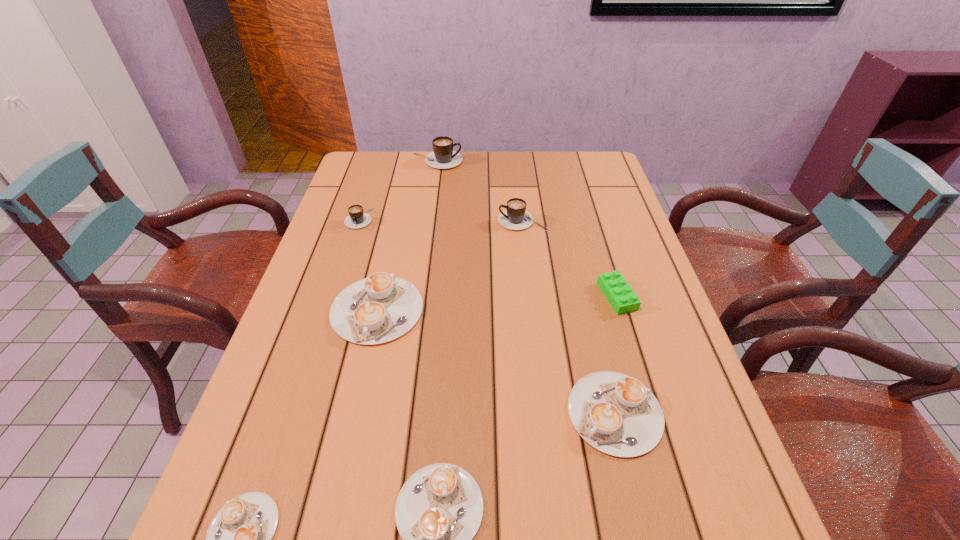
Find the location of a particular element. Image resolution: width=960 pixels, height=540 pixels. cappuccino that is at the right edge is located at coordinates (616, 414).

This screenshot has width=960, height=540. In the image, there is a desktop. In order to click on vacant area at the far edge in this screenshot , I will do `click(510, 153)`.

You are a GUI agent. You are given a task and a screenshot of the screen. Output one action in this format:
    pyautogui.click(x=<x>, y=<y>)
    Task: Click on the blank space at the left edge of the desktop
    This screenshot has width=960, height=540.
    Given the screenshot: What is the action you would take?
    pyautogui.click(x=377, y=226)

In the image, there is a desktop. Identify the location of free space at the right edge. (634, 231).

In the image, there is a desktop. Identify the location of vacant space at the far right corner. The height and width of the screenshot is (540, 960). (578, 166).

The image size is (960, 540). I want to click on vacant space that's between the Lego and the fourth nearest cappuccino, so click(497, 303).

The image size is (960, 540). What are the coordinates of `vacant area between the second tallest cappuccino and the fourth nearest cappuccino` in the screenshot? It's located at (449, 265).

Image resolution: width=960 pixels, height=540 pixels. In order to click on free space between the rightmost black cappuccino and the smallest black cappuccino in this screenshot , I will do `click(441, 220)`.

Where is `free space that is in between the biggest black cappuccino and the Lego`? Image resolution: width=960 pixels, height=540 pixels. free space that is in between the biggest black cappuccino and the Lego is located at coordinates (527, 228).

Identify which object is located as the nearest to the farthest black cappuccino. Please provide its 2D coordinates. Your answer should be formatted as a tuple, i.e. [(x, y)], where the tuple contains the x and y coordinates of a point satisfying the conditions above.

[(357, 218)]